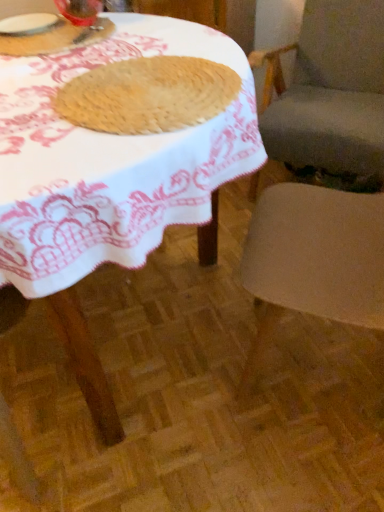
Where is `free space between golden brown textured cookie at center and transparent glass at upper left, positioned as the second tableware in left-to-right order`? free space between golden brown textured cookie at center and transparent glass at upper left, positioned as the second tableware in left-to-right order is located at coordinates tap(101, 50).